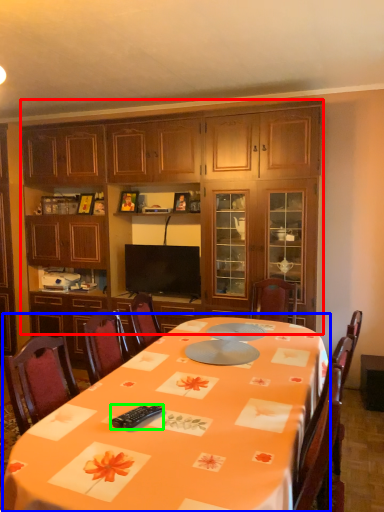
Question: Which object is positioned closest to cabinetry (highlighted by a red box)? Select from round table (highlighted by a blue box) and remote control (highlighted by a green box).

Choices:
 (A) round table
 (B) remote control

Answer: (A)